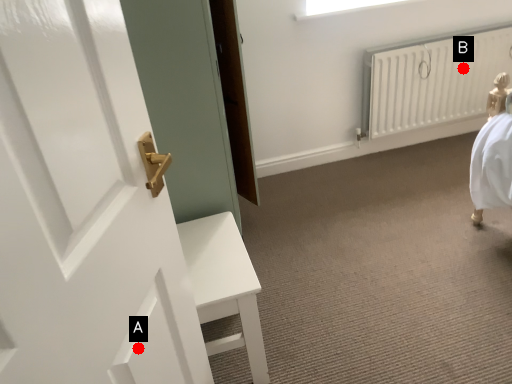
Question: Two points are circled on the image, labeled by A and B beside each circle. Which point appears farthest from the camera in this image?

Choices:
 (A) A is further
 (B) B is further

Answer: (B)